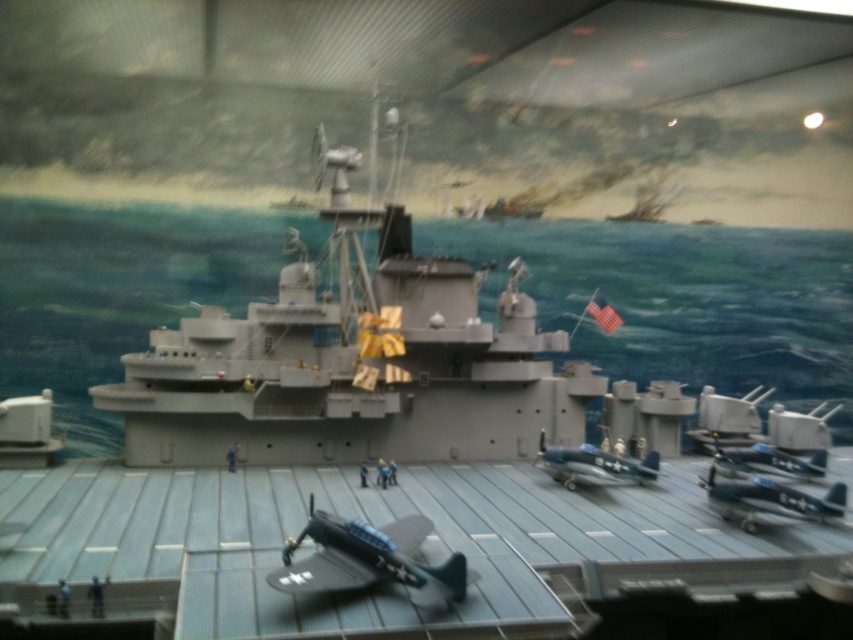
In the scene shown: Who is taller, matte black airplane at center or blue metallic airplane at center?

Standing taller between the two is matte black airplane at center.

Can you confirm if matte black airplane at center is thinner than blue metallic airplane at center?

No, matte black airplane at center is not thinner than blue metallic airplane at center.

Is point (396, 532) less distant than point (605, 481)?

That is True.

Find the location of a particular element. This screenshot has width=853, height=640. matte black airplane at center is located at coordinates (370, 560).

Find the location of a particular element. matte black airplane at center is located at coordinates (x=370, y=560).

Does matte black airplane at center have a greater height compared to metallic blue airplane at center-right?

Yes, matte black airplane at center is taller than metallic blue airplane at center-right.

Is point (444, 572) farther from camera compared to point (741, 470)?

No, it is in front of (741, 470).

Locate an element on the screen. The height and width of the screenshot is (640, 853). matte black airplane at center is located at coordinates (370, 560).

Does metallic blue airplane at center have a lesser height compared to metallic blue airplane at center-right?

Incorrect, metallic blue airplane at center's height does not fall short of metallic blue airplane at center-right's.

Is metallic blue airplane at center in front of metallic blue airplane at center-right?

Yes, it is in front of metallic blue airplane at center-right.

Which is in front, point (792, 493) or point (809, 474)?

Point (792, 493) is in front.

Identify the location of metallic blue airplane at center. (769, 499).